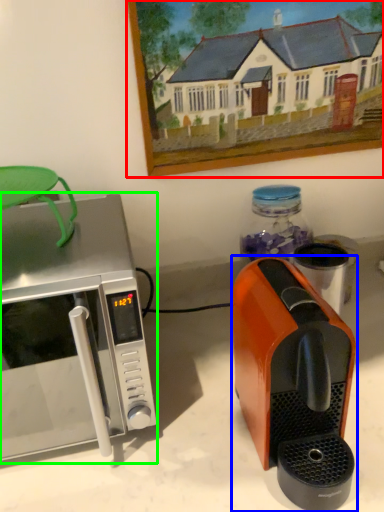
Question: Which is farther away from picture frame (highlighted by a red box)? coffee maker (highlighted by a blue box) or microwave oven (highlighted by a green box)?

Choices:
 (A) coffee maker
 (B) microwave oven

Answer: (A)